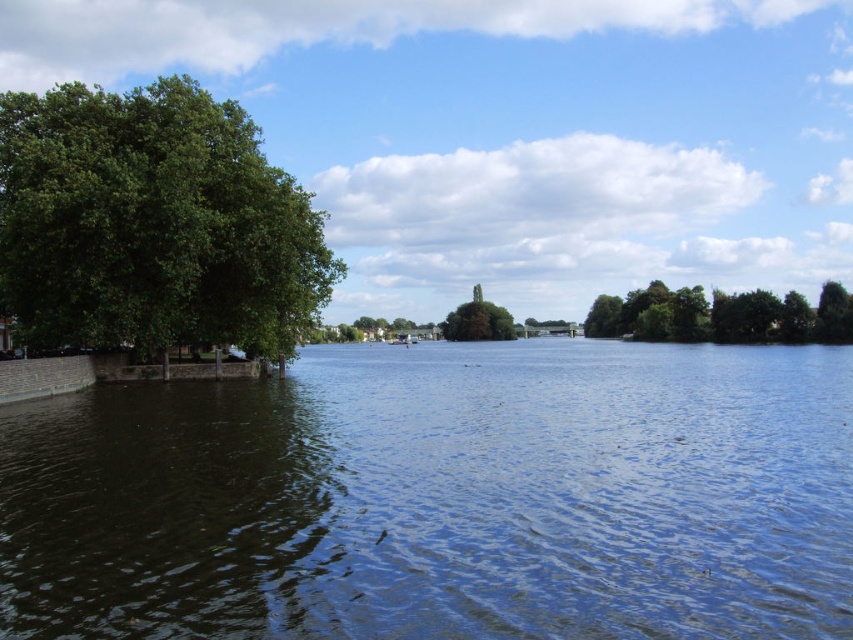
Question: Which object is the closest to the green leafy tree at center?

Choices:
 (A) green leafy trees at center
 (B) green leafy tree at left
 (C) dark blue water at center

Answer: (A)

Question: Can you confirm if green leafy tree at left is positioned above green leafy tree at center?

Choices:
 (A) yes
 (B) no

Answer: (B)

Question: Can you confirm if dark blue water at center is positioned to the left of green leafy tree at left?

Choices:
 (A) no
 (B) yes

Answer: (A)

Question: Which point is farther to the camera?

Choices:
 (A) (189, 275)
 (B) (846, 496)
 (C) (479, 289)
 (D) (793, 326)

Answer: (C)

Question: Can you confirm if green leafy trees at center is positioned to the left of green leafy tree at center?

Choices:
 (A) yes
 (B) no

Answer: (B)

Question: Which is nearer to the green leafy tree at left?

Choices:
 (A) green leafy trees at center
 (B) green leafy tree at center

Answer: (A)